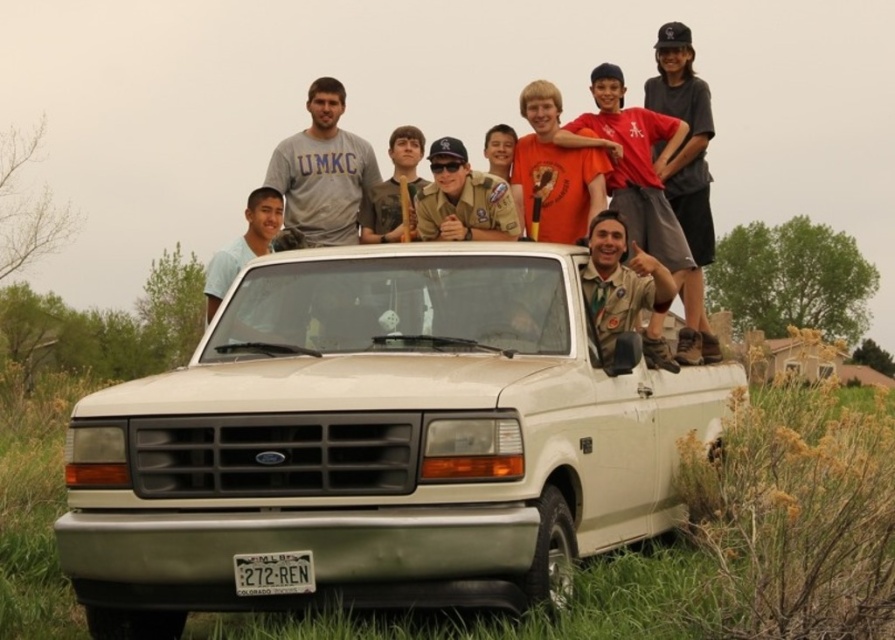
Question: Which of the following is the farthest from the observer?

Choices:
 (A) (354, 237)
 (B) (611, 362)

Answer: (A)

Question: Considering the real-world distances, which object is farthest from the gray cotton t-shirt at upper center?

Choices:
 (A) matte khaki uniform at center
 (B) white matte pickup truck at center

Answer: (B)

Question: Can you confirm if gray cotton t-shirt at upper center is bigger than matte khaki uniform at center?

Choices:
 (A) yes
 (B) no

Answer: (A)

Question: Can you confirm if gray cotton t-shirt at upper center is positioned to the left of matte khaki uniform at center?

Choices:
 (A) yes
 (B) no

Answer: (A)

Question: Does white matte pickup truck at center have a smaller size compared to gray cotton t-shirt at upper center?

Choices:
 (A) no
 (B) yes

Answer: (A)

Question: Which point appears farthest from the camera in this image?

Choices:
 (A) pyautogui.click(x=304, y=138)
 (B) pyautogui.click(x=147, y=426)
 (C) pyautogui.click(x=610, y=305)

Answer: (A)